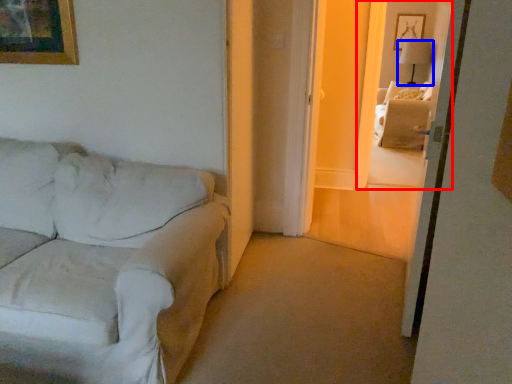
Question: Which of the following is the farthest to the observer, window (highlighted by a red box) or lamp (highlighted by a blue box)?

Choices:
 (A) window
 (B) lamp

Answer: (B)